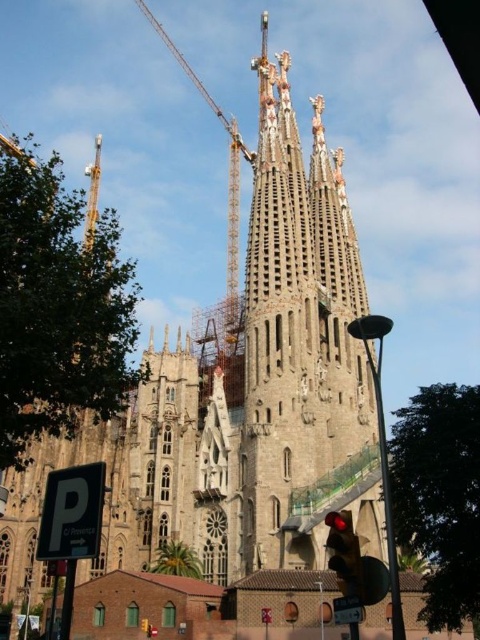
Question: Can you confirm if gray stone tower at center is thinner than red glass traffic light at lower center?

Choices:
 (A) yes
 (B) no

Answer: (B)

Question: Based on their relative distances, which object is nearer to the metallic construction crane at upper center?

Choices:
 (A) gray stone tower at center
 (B) red glass traffic light at lower center

Answer: (A)

Question: Which point is farther from the camera taking this photo?

Choices:
 (A) (226, 337)
 (B) (346, 512)
 (C) (249, 548)

Answer: (A)

Question: Which point is closer to the camera taking this photo?

Choices:
 (A) (358, 564)
 (B) (268, 129)
 (C) (186, 65)

Answer: (A)

Question: Does gray stone tower at center have a smaller size compared to red glass traffic light at lower center?

Choices:
 (A) no
 (B) yes

Answer: (A)

Question: Where is metallic construction crane at upper center located in relation to red glass traffic light at lower center in the image?

Choices:
 (A) above
 (B) below

Answer: (A)